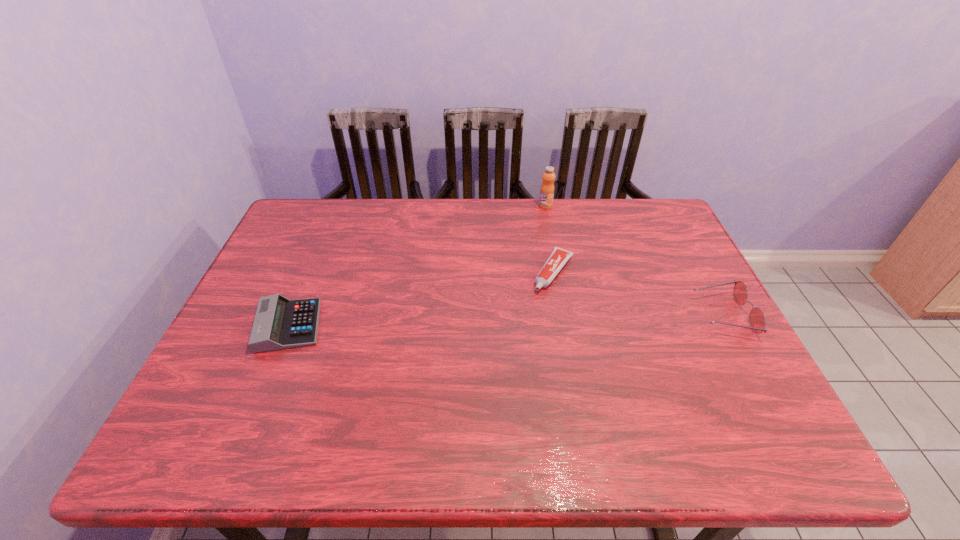
At what (x,y) coordinates should I click in order to perform the action: click on free location located 0.080m at the nozzle of the toothpaste. Please return your answer as a coordinate pair (x, y). Image resolution: width=960 pixels, height=540 pixels. Looking at the image, I should click on (533, 310).

What are the coordinates of `vacant space situated at the nozzle of the toothpaste` in the screenshot? It's located at (528, 318).

Identify the location of vacant area situated 0.340m at the nozzle of the toothpaste. (484, 383).

What are the coordinates of `free space located 0.170m on the front label of the tallest object` in the screenshot? It's located at (532, 238).

Locate an element on the screen. The height and width of the screenshot is (540, 960). blank space located 0.160m on the front label of the tallest object is located at coordinates (532, 237).

The height and width of the screenshot is (540, 960). I want to click on vacant space situated 0.200m on the front label of the tallest object, so click(529, 244).

At what (x,y) coordinates should I click in order to perform the action: click on object that is at the far edge. Please return your answer as a coordinate pair (x, y). The width and height of the screenshot is (960, 540). Looking at the image, I should click on (547, 188).

Identify the location of object located in the left edge section of the desktop. (279, 323).

Where is `object that is at the right edge`? This screenshot has width=960, height=540. object that is at the right edge is located at coordinates (757, 320).

Image resolution: width=960 pixels, height=540 pixels. What are the coordinates of `vacant space at the far edge` in the screenshot? It's located at (521, 231).